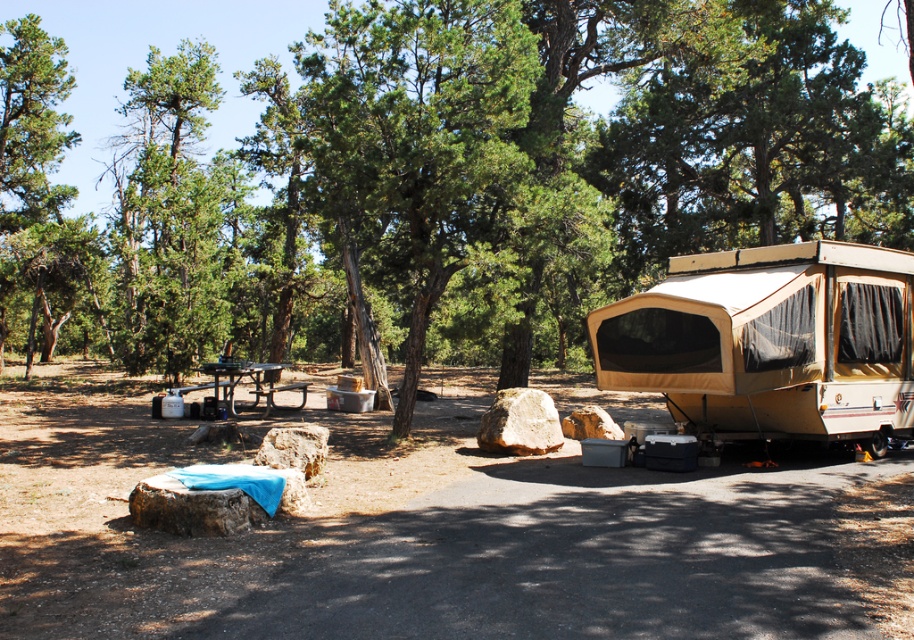
Question: Among these objects, which one is farthest from the camera?

Choices:
 (A) tan fabric camper at right
 (B) metallic picnic table at center

Answer: (B)

Question: Which point is closer to the camera taking this photo?

Choices:
 (A) (822, 312)
 (B) (256, 401)

Answer: (A)

Question: Can you confirm if tan fabric camper at right is wider than metallic picnic table at center?

Choices:
 (A) no
 (B) yes

Answer: (A)

Question: In this image, where is tan fabric camper at right located relative to metallic picnic table at center?

Choices:
 (A) above
 (B) below

Answer: (A)

Question: Is tan fabric camper at right in front of metallic picnic table at center?

Choices:
 (A) no
 (B) yes

Answer: (B)

Question: Among these objects, which one is farthest from the camera?

Choices:
 (A) tan fabric camper at right
 (B) metallic picnic table at center

Answer: (B)